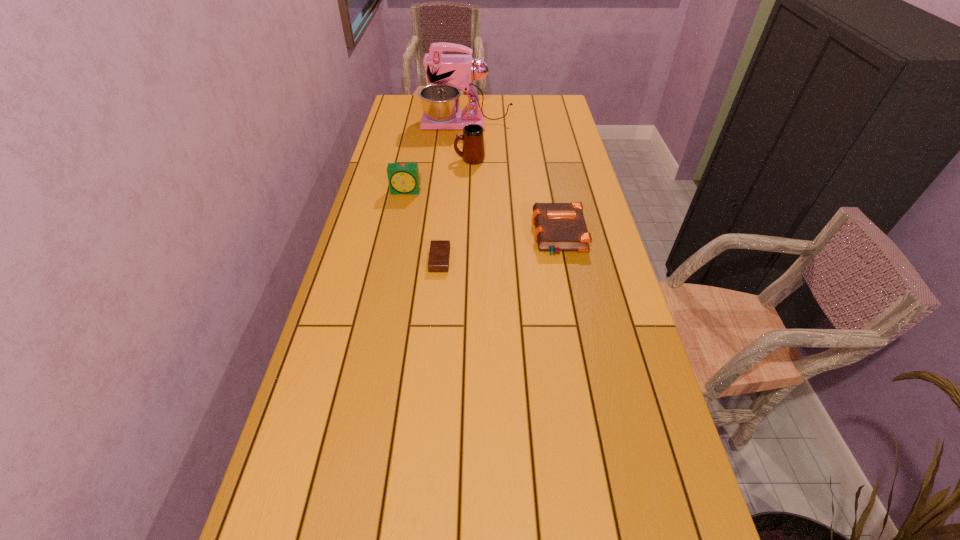
Where is `free space between the nearer alarm clock and the mixer`? Image resolution: width=960 pixels, height=540 pixels. free space between the nearer alarm clock and the mixer is located at coordinates (453, 192).

Image resolution: width=960 pixels, height=540 pixels. What are the coordinates of `empty location between the taller alarm clock and the mixer` in the screenshot? It's located at (437, 158).

The height and width of the screenshot is (540, 960). In order to click on vacant area that lies between the left alarm clock and the mug in this screenshot , I will do `click(438, 176)`.

Where is `free point between the shorter alarm clock and the farther alarm clock`? The image size is (960, 540). free point between the shorter alarm clock and the farther alarm clock is located at coordinates (423, 226).

Identify the location of vacant area that lies between the nearer alarm clock and the farther alarm clock. This screenshot has width=960, height=540. pyautogui.click(x=423, y=226).

At what (x,y) coordinates should I click in order to perform the action: click on unoccupied area between the third tallest object and the second farthest object. Please return your answer as a coordinate pair (x, y). This screenshot has height=540, width=960. Looking at the image, I should click on (438, 176).

At what (x,y) coordinates should I click in order to perform the action: click on the fourth closest object relative to the second tallest object. Please return your answer as a coordinate pair (x, y). Looking at the image, I should click on (439, 253).

Point out which object is positioned as the third nearest to the mug. Please provide its 2D coordinates. Your answer should be formatted as a tuple, i.e. [(x, y)], where the tuple contains the x and y coordinates of a point satisfying the conditions above.

[(559, 227)]

Locate an element on the screen. This screenshot has width=960, height=540. free space that satisfies the following two spatial constraints: 1. on the side of the second farthest object with the handle; 2. on the front-facing side of the taller alarm clock is located at coordinates point(468,192).

Locate an element on the screen. blank area in the image that satisfies the following two spatial constraints: 1. on the face of the farthest object; 2. on the front-facing side of the third nearest object is located at coordinates (464, 192).